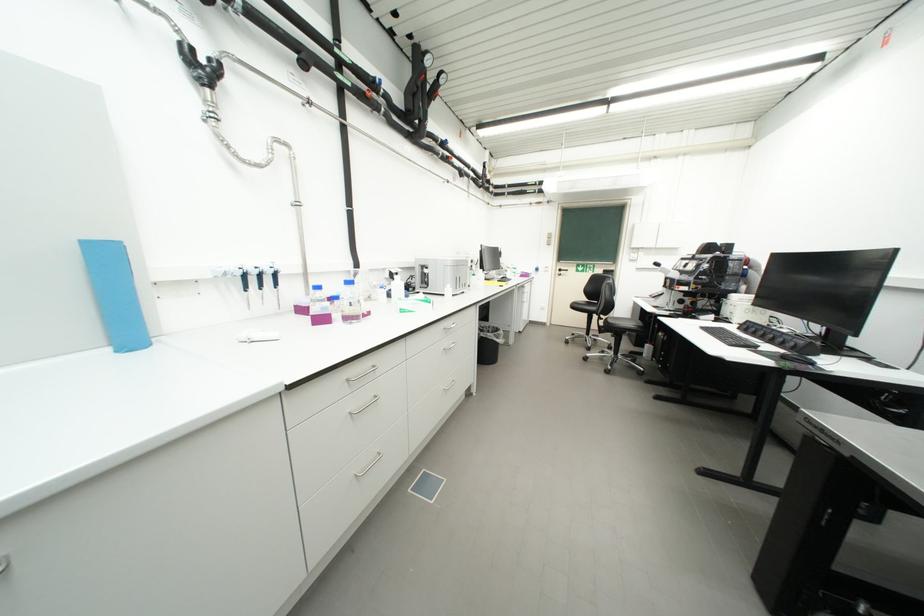
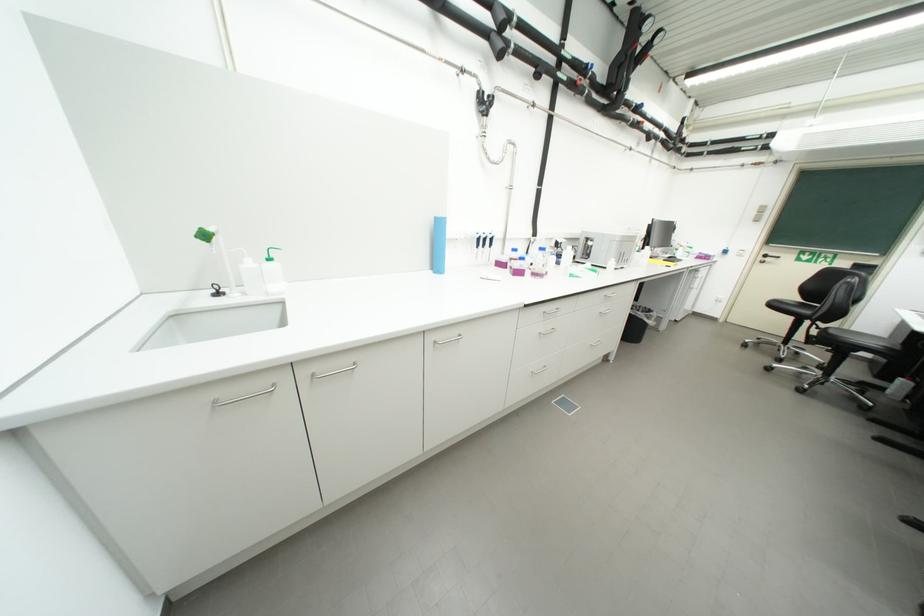
Locate, in the second image, the point that corresponds to the point at 499,338 in the first image.

(649, 317)